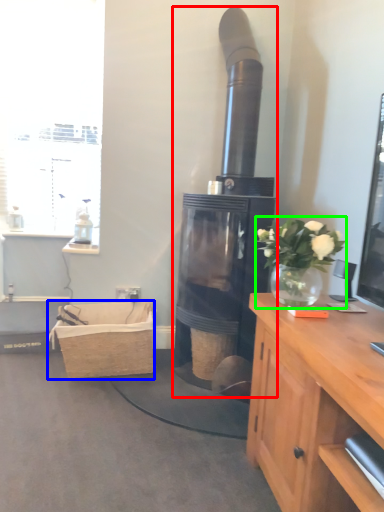
Question: Based on their relative distances, which object is farther from fireplace (highlighted by a red box)? Choose from picnic basket (highlighted by a blue box) and houseplant (highlighted by a green box).

Choices:
 (A) picnic basket
 (B) houseplant

Answer: (B)